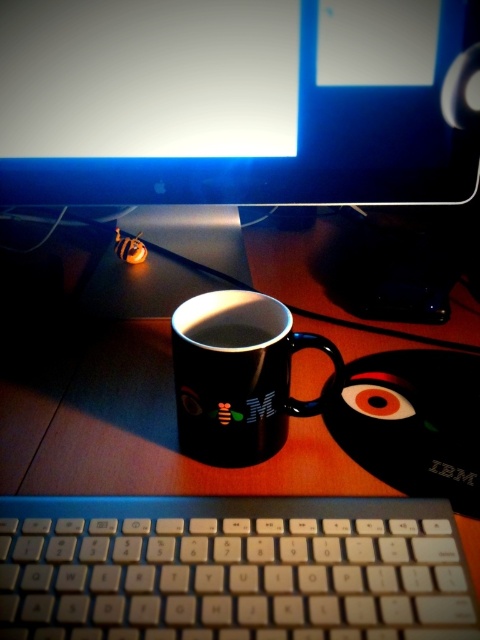
You are setting up a new workspace and want to place a mouse between the white plastic keyboard at lower center and the black glossy mug at center. Can you fit a mouse that is 4 inches long between them?

The distance between the white plastic keyboard at lower center and the black glossy mug at center is 4.59 inches, which is more than enough to fit a 4 inch long mouse between them.

You are setting up your desk and want to place a new mousepad between the white plastic keyboard at lower center and the black glossy mug at center. Based on their sizes, which object should the mousepad be placed closer to?

The white plastic keyboard at lower center is shorter than the black glossy mug at center, so the mousepad should be placed closer to the black glossy mug at center to ensure proper spacing between the two objects.